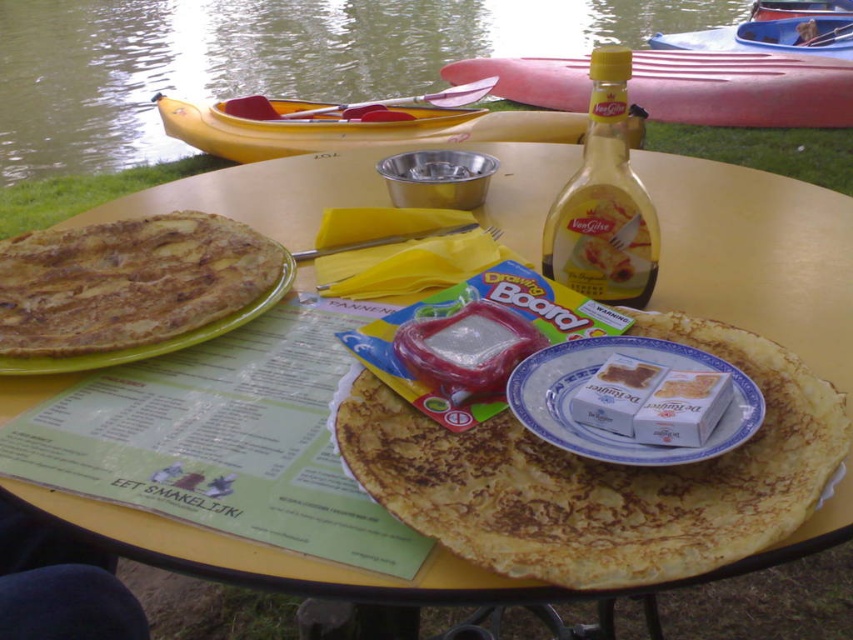
Question: Can you confirm if yellow glass bottle at center is smaller than translucent plastic butter at center?

Choices:
 (A) yes
 (B) no

Answer: (B)

Question: Where is brown crispy pancake at center located in relation to translucent plastic butter at center in the image?

Choices:
 (A) above
 (B) below

Answer: (A)

Question: Based on their relative distances, which object is farther from the matte white cream at center?

Choices:
 (A) golden crispy pancake at center
 (B) yellow glass bottle at center

Answer: (B)

Question: Among these points, which one is farthest from the camera?

Choices:
 (A) (454, 339)
 (B) (15, 307)
 (C) (595, 372)

Answer: (B)

Question: Which of the following is the closest to the observer?

Choices:
 (A) tap(599, 234)
 (B) tap(634, 353)
 (C) tap(757, 364)

Answer: (C)

Question: Can you confirm if greenish water at table center is positioned to the right of yellow plastic canoe at upper left?

Choices:
 (A) no
 (B) yes

Answer: (A)